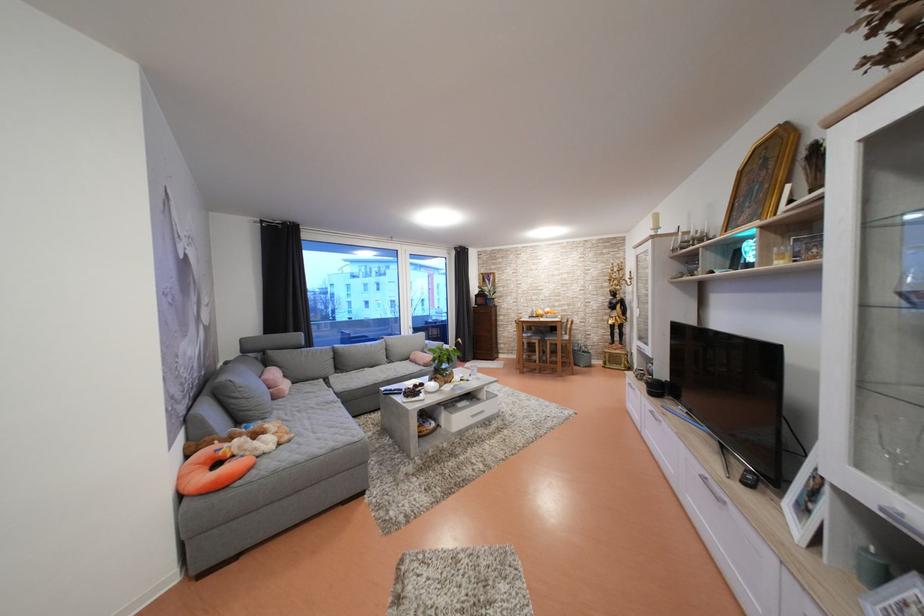
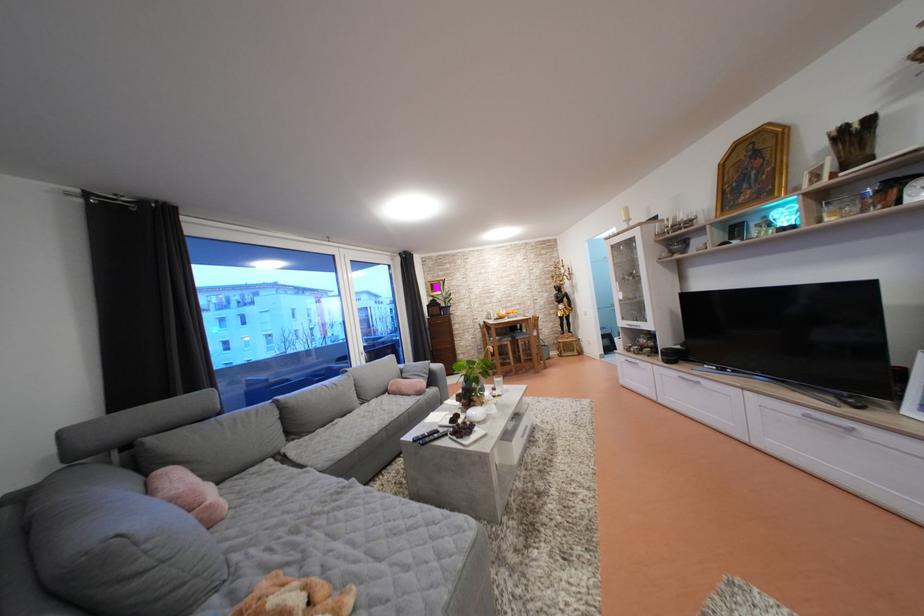
In a continuous first-person perspective shot, in which direction is the camera moving?

The movement direction of the cameraman is left, forward.